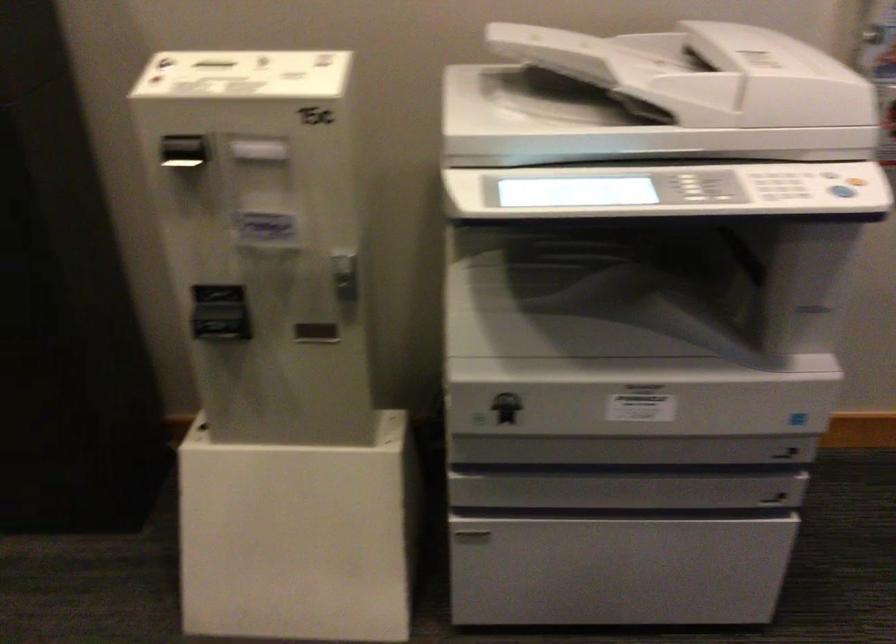
Identify the location of scanner lid. The width and height of the screenshot is (896, 644). (702, 73).